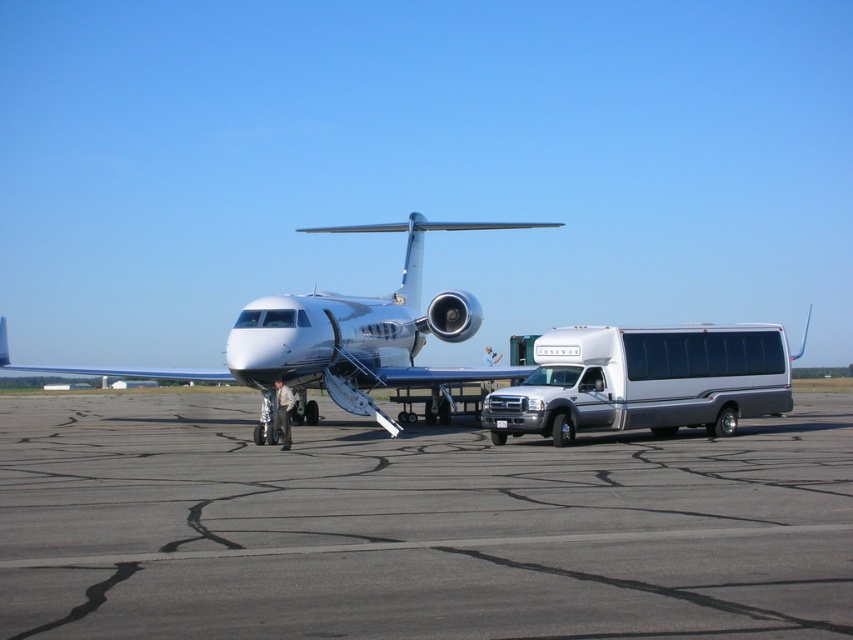
Is gray asphalt tarmac at center above white metallic van at center?

No, gray asphalt tarmac at center is not above white metallic van at center.

Describe the element at coordinates (415, 529) in the screenshot. I see `gray asphalt tarmac at center` at that location.

Does point (770, 468) come closer to viewer compared to point (524, 401)?

Yes.

Where is `gray asphalt tarmac at center`? gray asphalt tarmac at center is located at coordinates (415, 529).

I want to click on white metallic van at center, so click(643, 381).

Between point (570, 333) and point (241, 337), which one is positioned in front?

Point (570, 333) is more forward.

The image size is (853, 640). What are the coordinates of `white metallic van at center` in the screenshot? It's located at (643, 381).

Does gray asphalt tarmac at center have a lesser width compared to white glossy airplane at center?

Indeed, gray asphalt tarmac at center has a lesser width compared to white glossy airplane at center.

Does gray asphalt tarmac at center appear on the left side of white glossy airplane at center?

No, gray asphalt tarmac at center is not to the left of white glossy airplane at center.

The width and height of the screenshot is (853, 640). What do you see at coordinates (415, 529) in the screenshot?
I see `gray asphalt tarmac at center` at bounding box center [415, 529].

Image resolution: width=853 pixels, height=640 pixels. I want to click on gray asphalt tarmac at center, so coord(415,529).